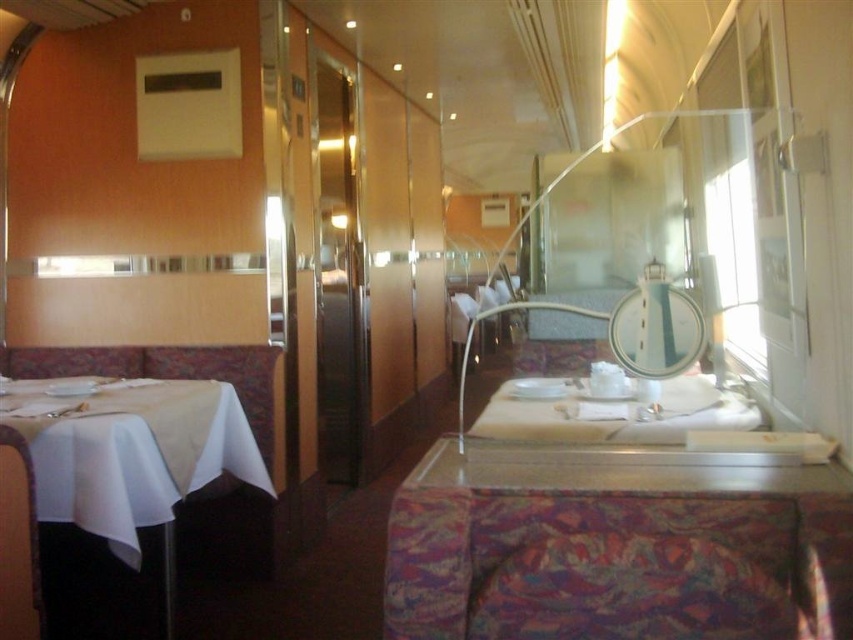
Question: Does white cloth table at left have a larger size compared to white glossy plate at center?

Choices:
 (A) no
 (B) yes

Answer: (B)

Question: Which point is farther from the camera taking this photo?

Choices:
 (A) (682, 378)
 (B) (73, 420)

Answer: (A)

Question: Does patterned fabric table at center have a larger size compared to white cloth table at left?

Choices:
 (A) no
 (B) yes

Answer: (A)

Question: Does patterned fabric table at center appear over white glossy plate at center?

Choices:
 (A) no
 (B) yes

Answer: (A)

Question: Which object is farther from the camera taking this photo?

Choices:
 (A) white cloth table at left
 (B) white glossy plate at center

Answer: (A)

Question: Which point is farther from the camera taking this photo?

Choices:
 (A) (541, 419)
 (B) (755, 573)
 (C) (100, 404)

Answer: (C)